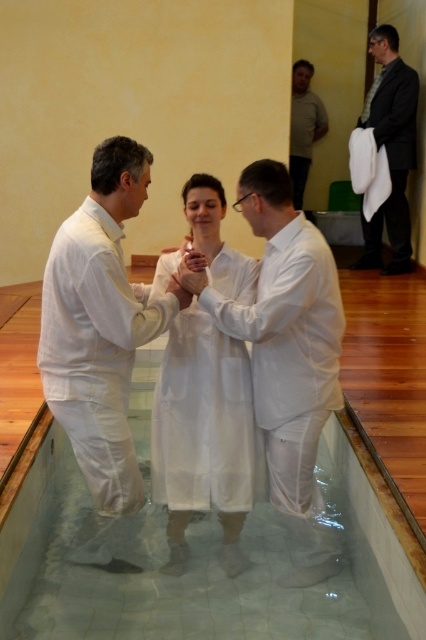
Question: Which is farther from the light brown textured shirt at upper right?

Choices:
 (A) dark gray suit at upper right
 (B) white matte robe at center
 (C) clear glass pool at center
 (D) white matte dress at center

Answer: (B)

Question: Which point is farther from the camera taking this photo?

Choices:
 (A) (305, 394)
 (B) (57, 504)
 (C) (391, 156)
 (D) (216, 269)

Answer: (C)

Question: Estimate the real-world distances between objects in this image. Which object is farther from the white matte dress at center?

Choices:
 (A) white matte robe at center
 (B) dark gray suit at upper right

Answer: (B)

Question: Can you confirm if white matte dress at center is bigger than clear glass pool at center?

Choices:
 (A) no
 (B) yes

Answer: (B)

Question: Is dark gray suit at upper right to the right of light brown textured shirt at upper right from the viewer's perspective?

Choices:
 (A) no
 (B) yes

Answer: (B)

Question: Does white matte shirt at center lie in front of dark gray suit at upper right?

Choices:
 (A) no
 (B) yes

Answer: (B)